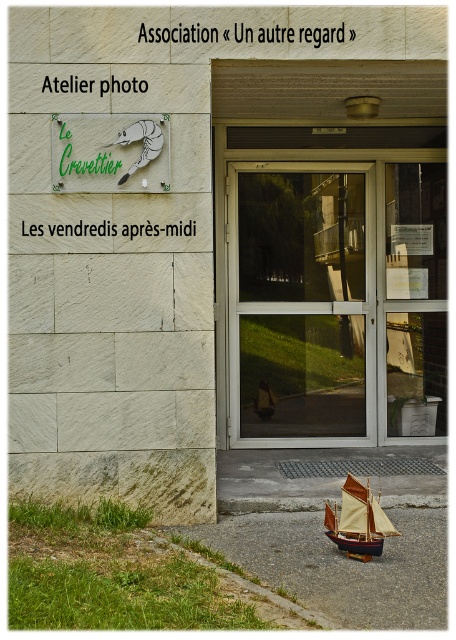
Question: Can you confirm if transparent glass door at center is bigger than green painted sign at upper left?

Choices:
 (A) no
 (B) yes

Answer: (B)

Question: Which point is closer to the camera?

Choices:
 (A) transparent glass door at center
 (B) wooden sailboat at lower right
 (C) matte silver shrimp at upper left

Answer: (B)

Question: Estimate the real-world distances between objects in this image. Which object is closer to the matte silver shrimp at upper left?

Choices:
 (A) wooden sailboat at lower right
 (B) transparent glass door at center
 (C) green painted sign at upper left

Answer: (C)

Question: Does green painted sign at upper left appear under wooden sailboat at lower right?

Choices:
 (A) no
 (B) yes

Answer: (A)

Question: Does transparent glass door at center appear under green painted sign at upper left?

Choices:
 (A) yes
 (B) no

Answer: (A)

Question: Which point appears closest to the camera in this image?

Choices:
 (A) (328, 528)
 (B) (243, 269)
 (C) (131, 150)

Answer: (A)